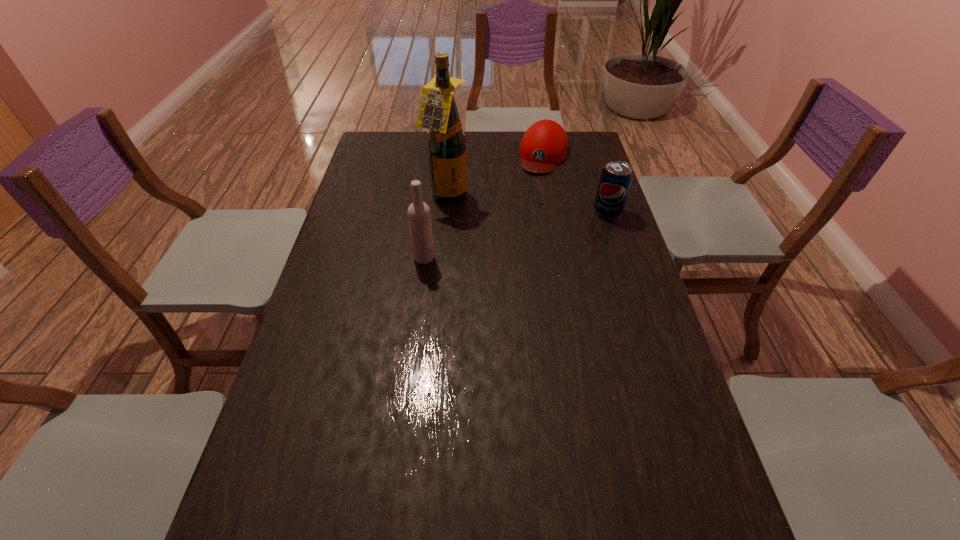
Locate an element on the screen. This screenshot has width=960, height=540. free spot between the third tallest object and the tallest object is located at coordinates (527, 205).

You are a GUI agent. You are given a task and a screenshot of the screen. Output one action in this format:
    pyautogui.click(x=<x>, y=<y>)
    Task: Click on the unoccupied position between the shortest object and the nearest object
    This screenshot has width=960, height=540.
    Given the screenshot: What is the action you would take?
    pyautogui.click(x=484, y=207)

Where is `free space that is in between the tallest object and the third shortest object`? free space that is in between the tallest object and the third shortest object is located at coordinates (436, 228).

Identify which object is the second closest to the liquor. Please provide its 2D coordinates. Your answer should be formatted as a tuple, i.e. [(x, y)], where the tuple contains the x and y coordinates of a point satisfying the conditions above.

[(544, 144)]

Point out which object is positioned as the second nearest to the tallest object. Please provide its 2D coordinates. Your answer should be formatted as a tuple, i.e. [(x, y)], where the tuple contains the x and y coordinates of a point satisfying the conditions above.

[(544, 144)]

In order to click on blank area in the image that satisfies the following two spatial constraints: 1. on the front side of the liquor; 2. on the right side of the rightmost object in this screenshot , I will do `click(445, 212)`.

At what (x,y) coordinates should I click in order to perform the action: click on vacant point that satisfies the following two spatial constraints: 1. on the front side of the soda can; 2. on the left side of the shortest object. Please return your answer as a coordinate pair (x, y). The width and height of the screenshot is (960, 540). Looking at the image, I should click on (555, 212).

The height and width of the screenshot is (540, 960). Identify the location of free space that satisfies the following two spatial constraints: 1. on the front side of the liquor; 2. on the left side of the second shortest object. (445, 212).

You are a GUI agent. You are given a task and a screenshot of the screen. Output one action in this format:
    pyautogui.click(x=<x>, y=<y>)
    Task: Click on the free space that satisfies the following two spatial constraints: 1. on the back side of the soda can; 2. on the right side of the nearest object
    The image size is (960, 540).
    Given the screenshot: What is the action you would take?
    pyautogui.click(x=430, y=212)

Locate an element on the screen. The width and height of the screenshot is (960, 540). blank space that satisfies the following two spatial constraints: 1. on the back side of the tallest object; 2. on the right side of the nearest object is located at coordinates (432, 198).